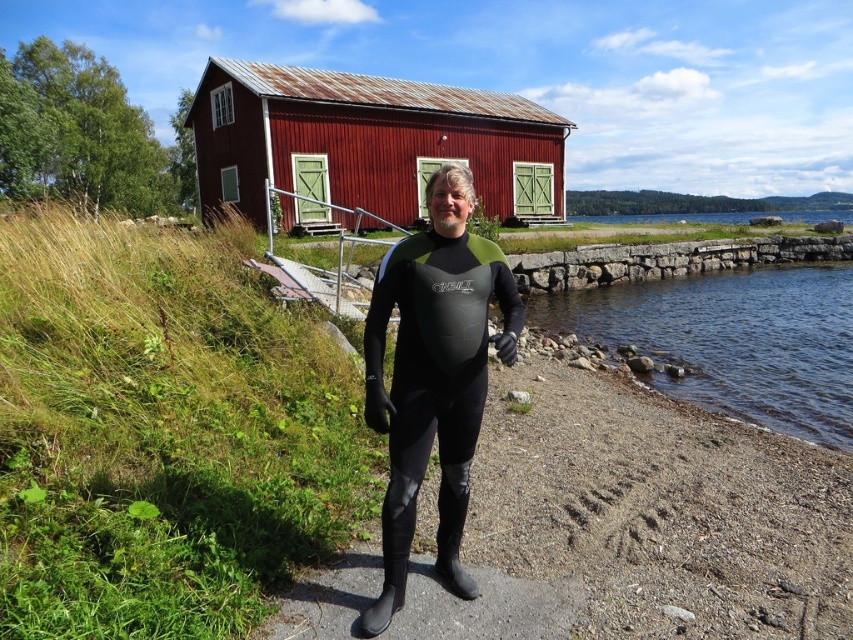
You are a visitor at the lakeside and want to take a photo of the rustic wood hut at center and the clear water at lower right. Which object should you focus on first if you want to capture both in one frame without moving the camera?

You should focus on the rustic wood hut at center first because it is positioned over the clear water at lower right, meaning they are aligned in a way that both can be captured in a single frame by focusing on the hut which is above the water.

You are standing on the gravel path near the water and want to reach the rustic wood hut at center. Which direction should you head relative to the clear water at lower right?

The rustic wood hut at center is to the left of the clear water at lower right, so you should head to the left of the clear water at lower right to reach the rustic wood hut at center.

You are a swimmer preparing to enter the water. You see the black neoprene wetsuit at center and the clear water at lower right. Which one is shorter in height?

The black neoprene wetsuit at center is shorter in height compared to the clear water at lower right.